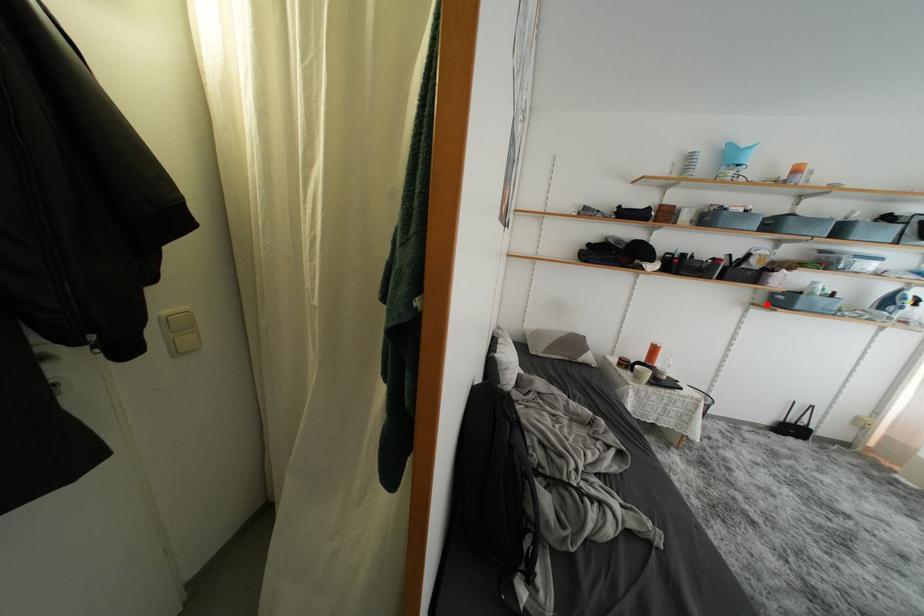
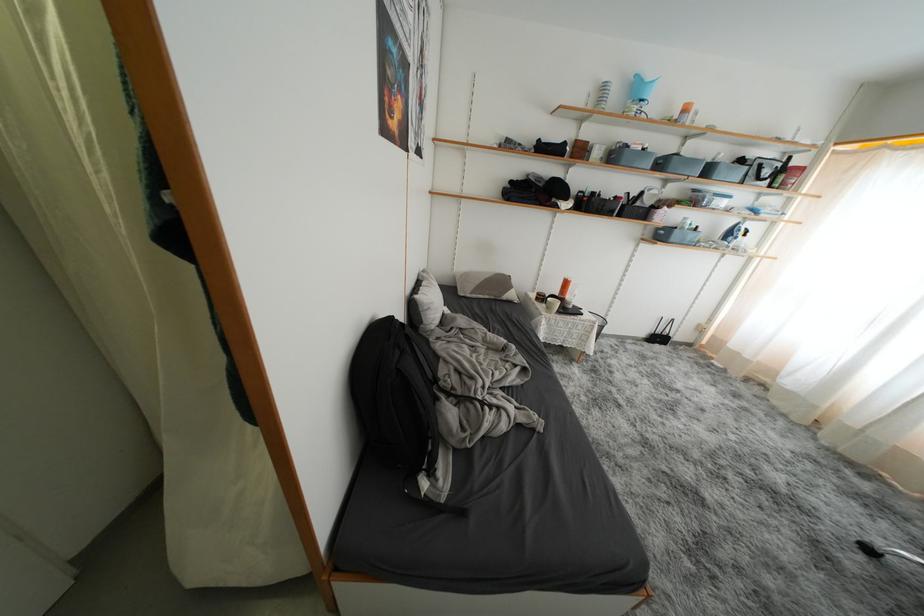
Question: I am providing you with two images of the same scene from different viewpoints. Given a red point in image1, look at the same physical point in image2. Is it:

Choices:
 (A) Closer to the viewpoint
 (B) Farther from the viewpoint

Answer: (A)